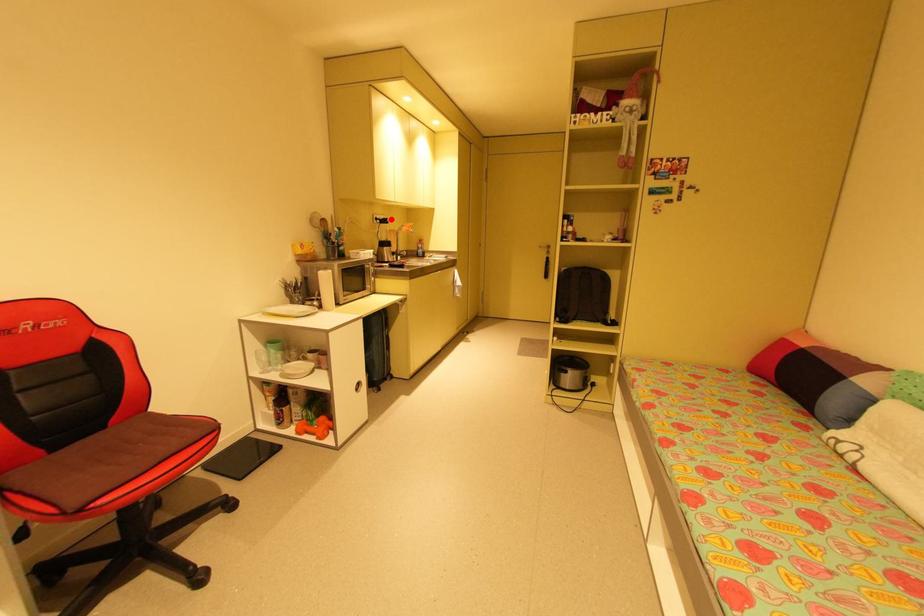
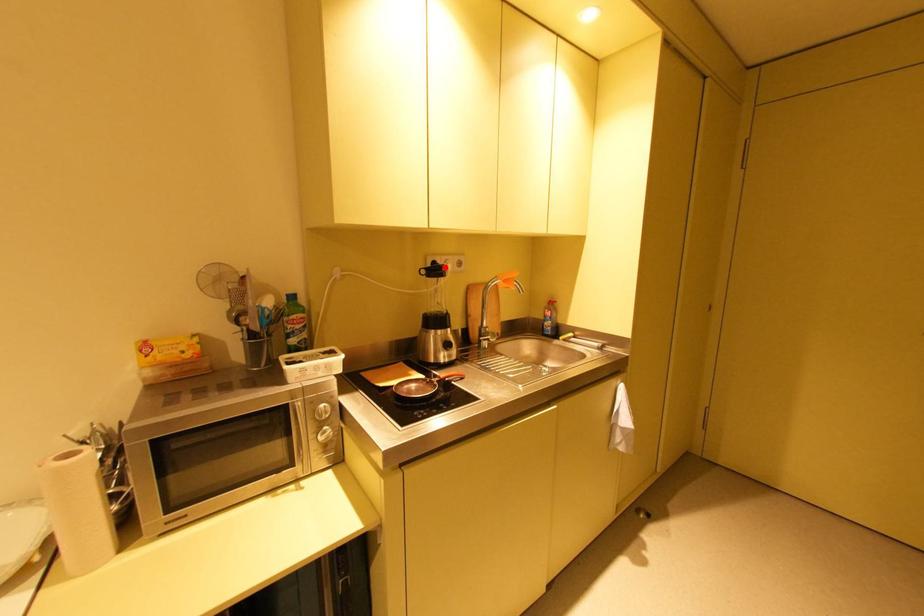
I am providing you with two images of the same scene from different viewpoints. A red point is marked on the first image and another point is marked on the second image. Does the point marked in image1 correspond to the same location as the one in image2?

Yes